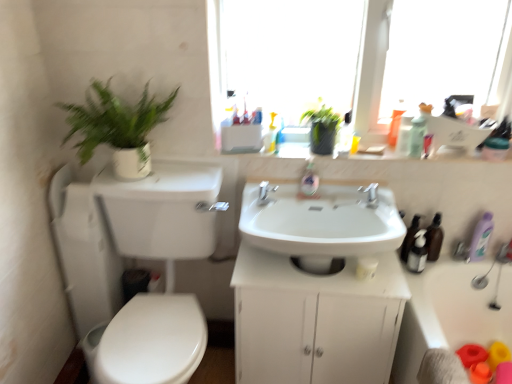
Find the location of a particular element. free space above translucent plastic bottles at upper center (from a real-world perspective) is located at coordinates (342, 153).